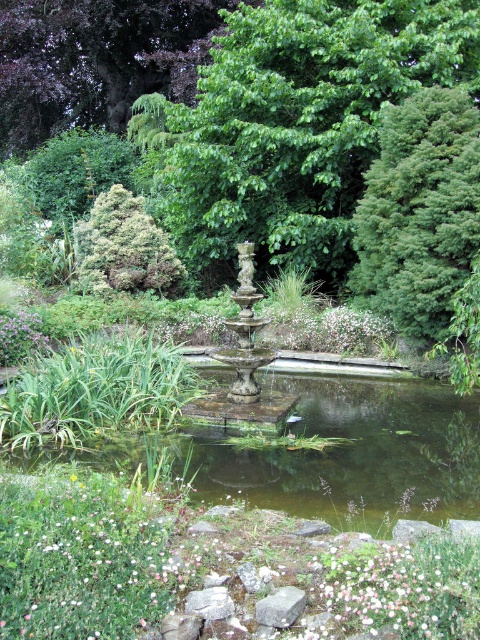
Question: Which is nearer to the green mossy fountain at center?

Choices:
 (A) gray rock at center
 (B) white soft flower at lower left
 (C) gray stone at lower center

Answer: (C)

Question: Which object is farther from the camera taking this photo?

Choices:
 (A) green textured bush at upper right
 (B) purple leafy tree at upper center
 (C) white soft flower at lower left
 (D) green leafy bush at upper left

Answer: (B)

Question: Is green mossy fountain at center positioned at the back of green textured bush at upper left?

Choices:
 (A) yes
 (B) no

Answer: (B)

Question: Is green mossy fountain at center smaller than gray stone at lower center?

Choices:
 (A) yes
 (B) no

Answer: (B)

Question: Which point is closer to the camera taking this photo?

Choices:
 (A) (277, 221)
 (B) (192, 593)

Answer: (B)

Question: Does green textured bush at upper left have a greater width compared to gray rough stone at center?

Choices:
 (A) no
 (B) yes

Answer: (B)